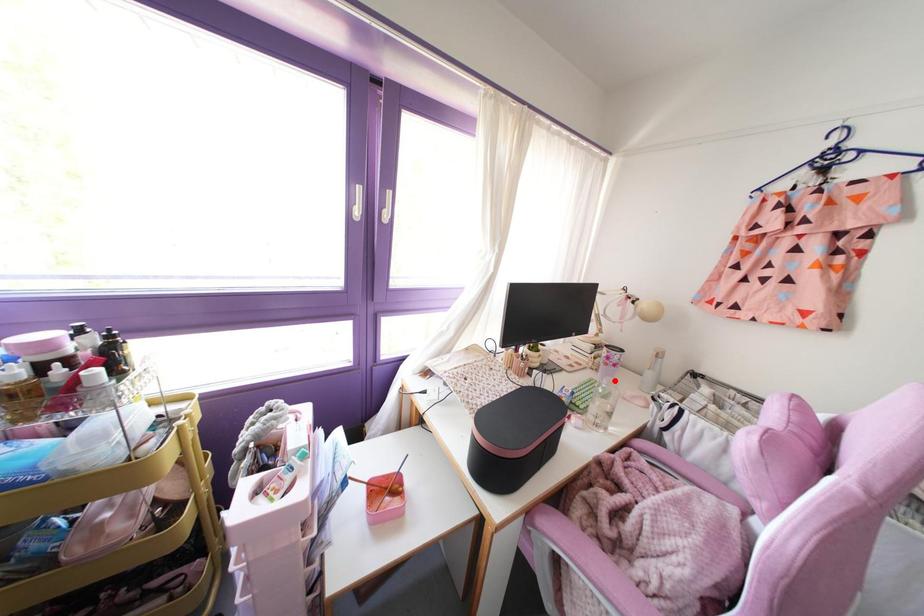
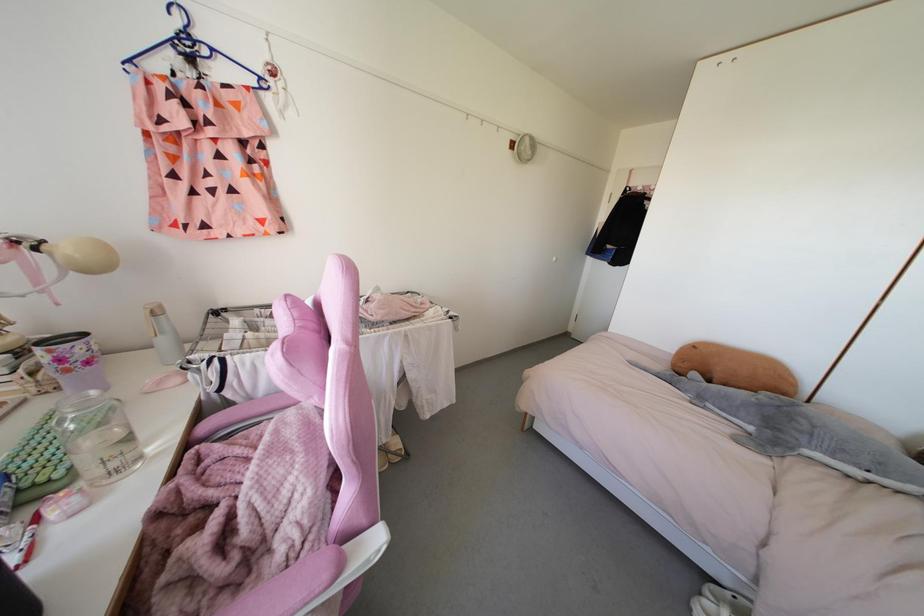
Find the pixel in the second image that matches the highlighted location in the first image.

(92, 392)